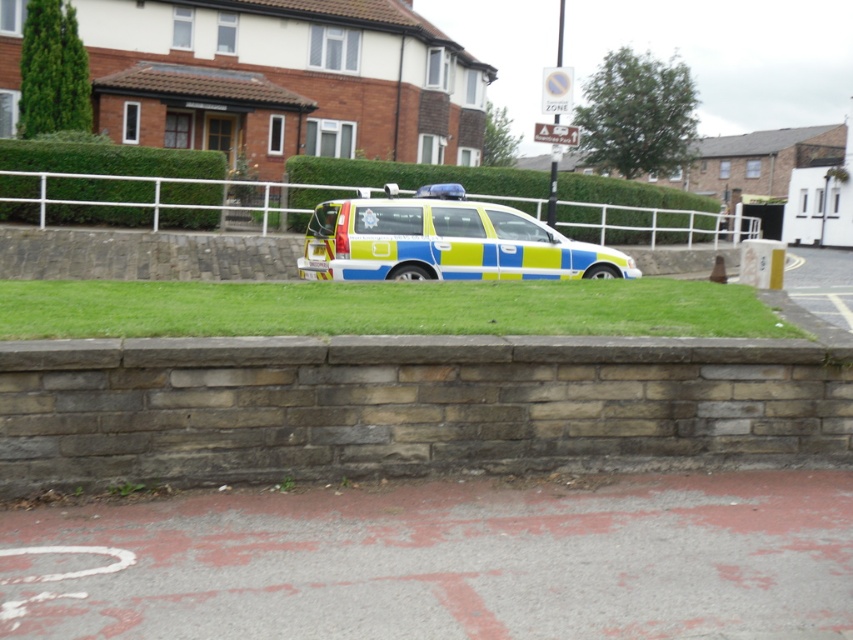
Question: Which point appears closest to the camera in this image?

Choices:
 (A) (497, 225)
 (B) (94, 193)

Answer: (A)

Question: Does blue-green metallic van at center appear over white metal fence at center?

Choices:
 (A) no
 (B) yes

Answer: (A)

Question: Does blue-green metallic van at center lie in front of white metal fence at center?

Choices:
 (A) no
 (B) yes

Answer: (B)

Question: Can you confirm if blue-green metallic van at center is positioned to the left of white metal fence at center?

Choices:
 (A) yes
 (B) no

Answer: (A)

Question: Which object is farther from the camera taking this photo?

Choices:
 (A) blue-green metallic van at center
 (B) white metal fence at center

Answer: (B)